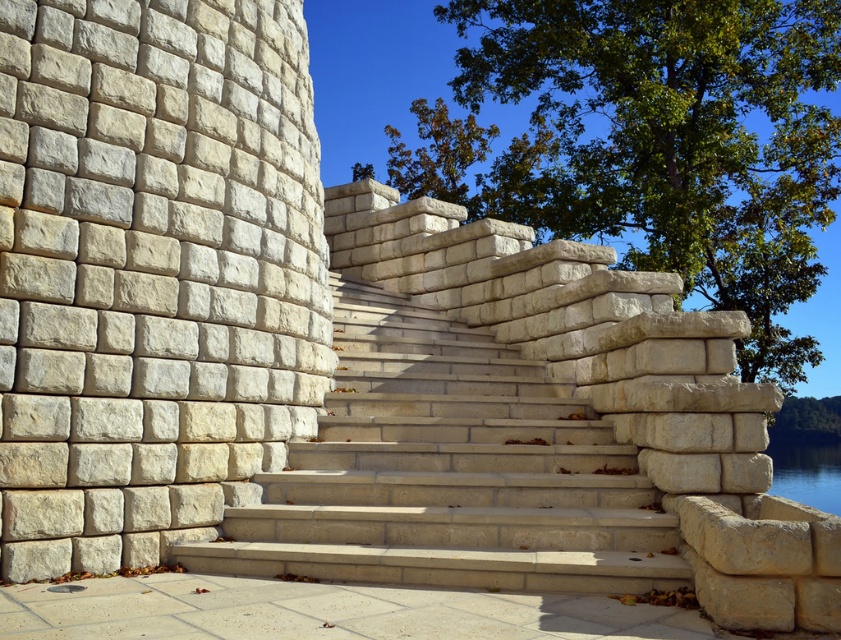
Question: Is green leafy tree at upper center wider than beige stone stairs at center?

Choices:
 (A) yes
 (B) no

Answer: (A)

Question: Which point appears closest to the camera in this image?

Choices:
 (A) (252, 586)
 (B) (283, 280)

Answer: (A)

Question: Which object appears closest to the camera in this image?

Choices:
 (A) green leafy tree at upper center
 (B) green leafy tree at lower right
 (C) clear water at bottom right
 (D) smooth concrete slab at lower center

Answer: (D)

Question: Which object is farther from the camera taking this photo?

Choices:
 (A) beige stone stairs at center
 (B) green leafy tree at upper center
 (C) smooth concrete slab at lower center
 (D) green leafy tree at lower right

Answer: (D)

Question: Is light beige stone wall at left bigger than green leafy tree at lower right?

Choices:
 (A) yes
 (B) no

Answer: (A)

Question: Is beige stone stairs at center to the left of smooth concrete slab at lower center from the viewer's perspective?

Choices:
 (A) yes
 (B) no

Answer: (B)